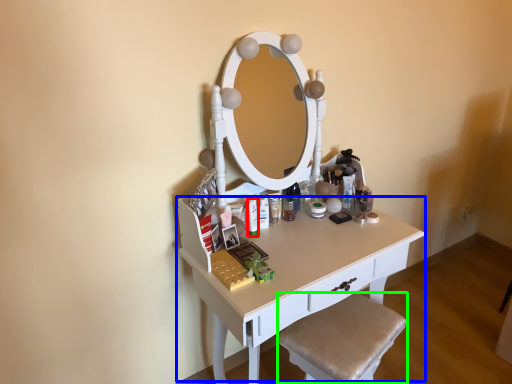
Question: Which object is the closest to the toiletry (highlighted by a red box)? Choose among these: table (highlighted by a blue box) or step stool (highlighted by a green box).

Choices:
 (A) table
 (B) step stool

Answer: (A)